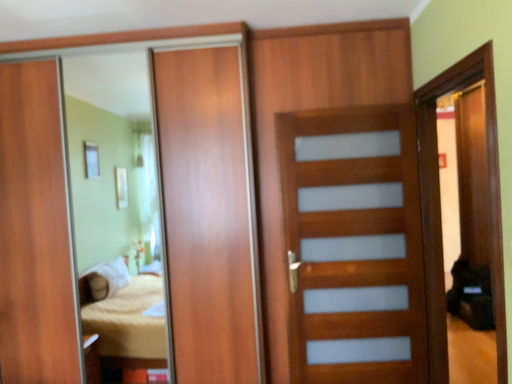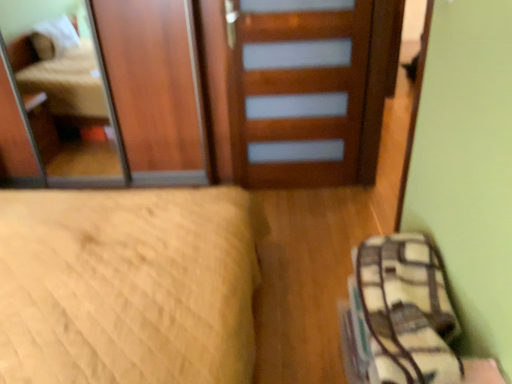
Question: Which way did the camera rotate in the video?

Choices:
 (A) rotated upward
 (B) rotated downward

Answer: (B)